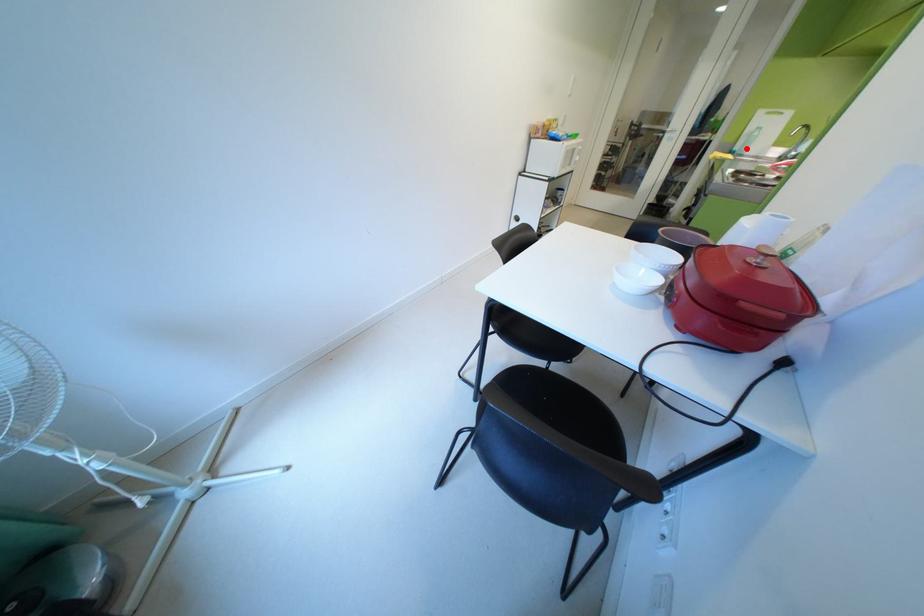
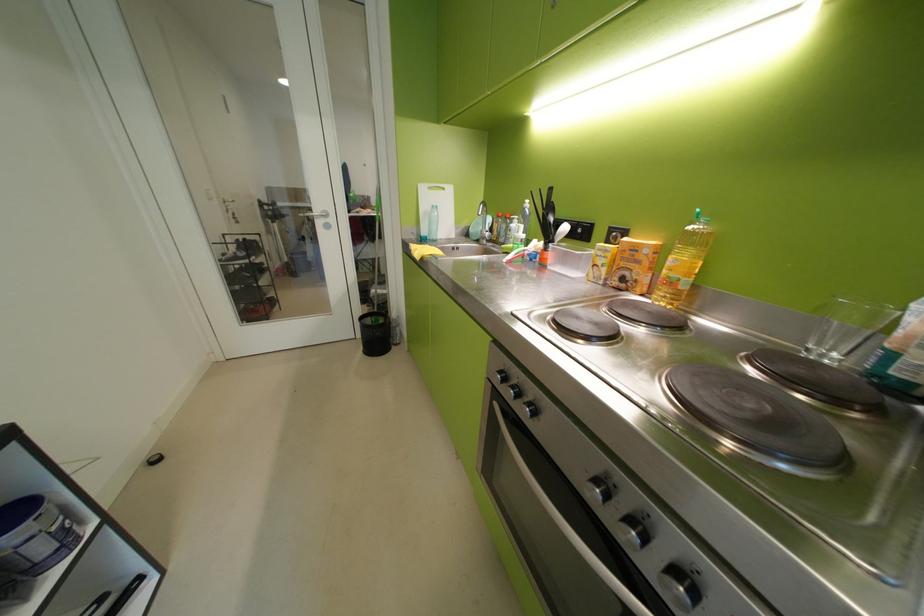
Locate, in the second image, the point that corresponds to the highlighted location in the first image.

(433, 233)